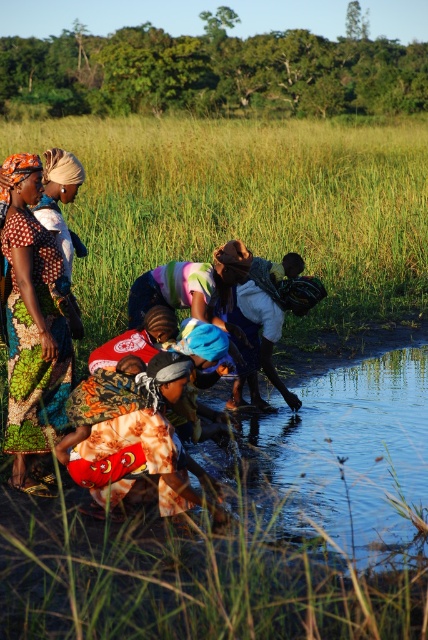
You are standing at the edge of the river and see the printed fabric dress at center. If you want to reach the dress quickly, which direction should you move in relation to your current position?

The printed fabric dress at center is located at point (32, 330), so you should move towards the center of the scene to reach it quickly.

You are a photographer trying to capture a wide shot of the scene. You need to ensure that both the printed fabric dress at center and the printed fabric child at lower center are fully visible in the frame. Given their widths, which object will require more space horizontally to fit into the photo?

The printed fabric child at lower center requires more horizontal space because its width is greater than the printed fabric dress at center.